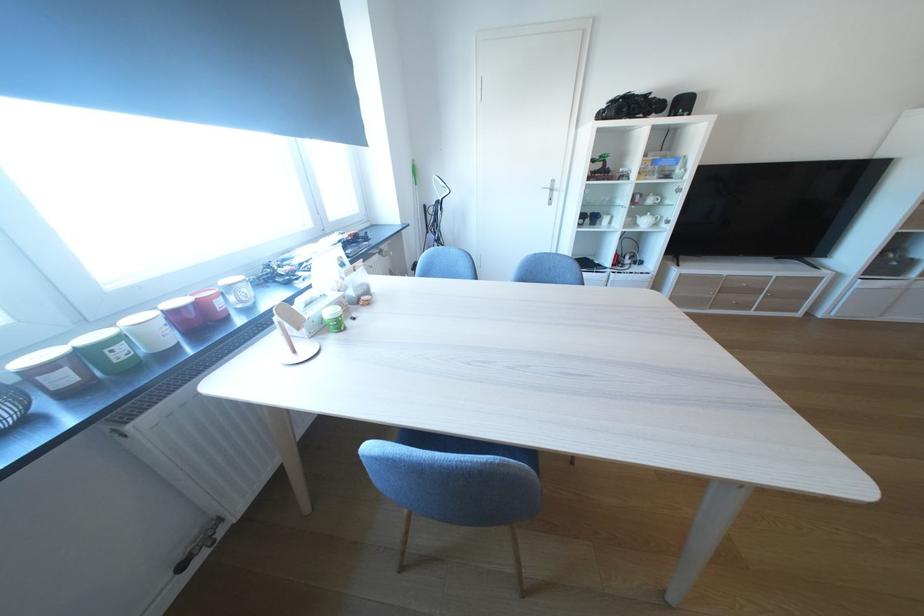
You are a GUI agent. You are given a task and a screenshot of the screen. Output one action in this format:
    pyautogui.click(x=<x>, y=<y>)
    Task: Click on the cabinet door handle
    Image resolution: width=924 pixels, height=616 pixels.
    Given the screenshot: What is the action you would take?
    550,191